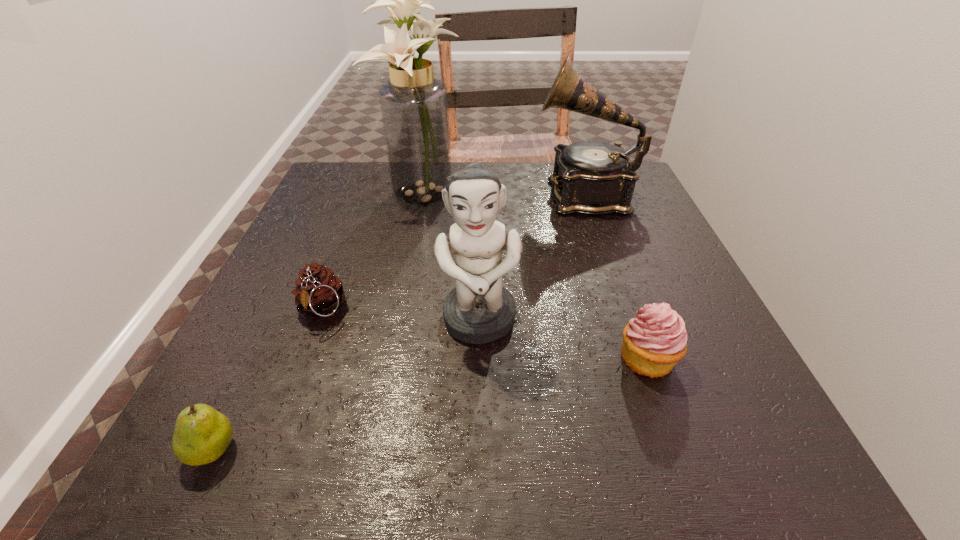
You are a GUI agent. You are given a task and a screenshot of the screen. Output one action in this format:
    pyautogui.click(x=<x>, y=<y>)
    Task: Click on the empty space between the cupcake and the flower arrangement
    
    Given the screenshot: What is the action you would take?
    pyautogui.click(x=535, y=275)

Identify the location of unoccupied position between the cupcake and the figurine. The width and height of the screenshot is (960, 540). (564, 340).

Where is `empty location between the figurine and the pinecone`? The height and width of the screenshot is (540, 960). empty location between the figurine and the pinecone is located at coordinates (400, 316).

Locate an element on the screen. free point between the cupcake and the phonograph record is located at coordinates (616, 276).

This screenshot has width=960, height=540. I want to click on vacant point located between the pear and the pinecone, so click(267, 380).

I want to click on object that is the fourth closest to the pear, so click(x=655, y=340).

Choose which object is the second nearest neighbor to the figurine. Please provide its 2D coordinates. Your answer should be formatted as a tuple, i.e. [(x, y)], where the tuple contains the x and y coordinates of a point satisfying the conditions above.

[(319, 292)]

Where is `vacant space that satisfies the following two spatial constraints: 1. on the horn of the cupcake; 2. on the right side of the phonograph record`? vacant space that satisfies the following two spatial constraints: 1. on the horn of the cupcake; 2. on the right side of the phonograph record is located at coordinates (642, 359).

The width and height of the screenshot is (960, 540). Identify the location of vacant space that satisfies the following two spatial constraints: 1. on the horn of the phonograph record; 2. on the front side of the pear. (674, 450).

Locate an element on the screen. Image resolution: width=960 pixels, height=540 pixels. free space that satisfies the following two spatial constraints: 1. on the horn of the phonograph record; 2. on the front-facing side of the figurine is located at coordinates (629, 321).